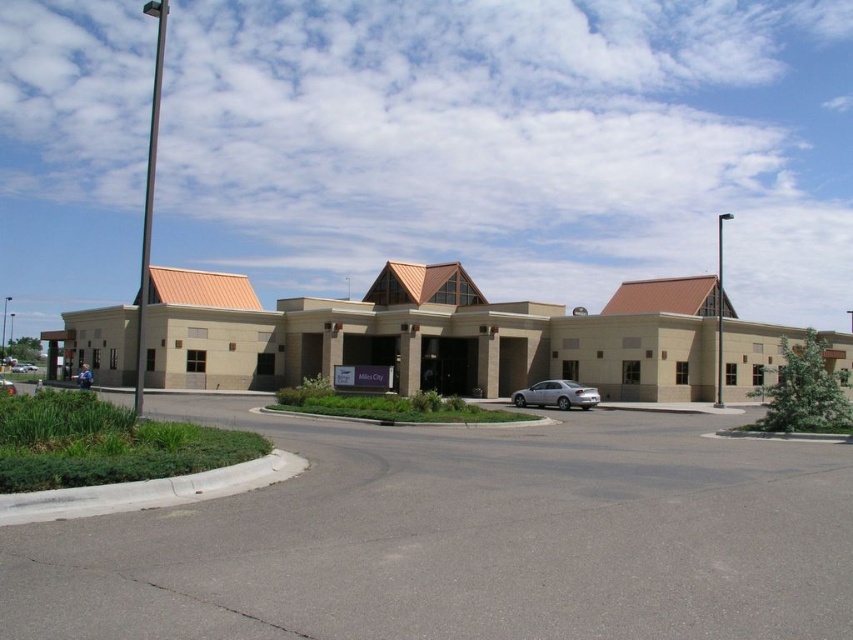
Is point (96, 618) positioned in front of point (100, 333)?

Yes, it is in front of point (100, 333).

Does gray asphalt parking lot at center have a lesser width compared to beige concrete building at center?

Correct, gray asphalt parking lot at center's width is less than beige concrete building at center's.

Does point (570, 596) lie behind point (430, 276)?

No, (570, 596) is closer to viewer.

Identify the location of gray asphalt parking lot at center. (463, 540).

Who is higher up, beige concrete building at center or silver metallic sedan at center?

Positioned higher is beige concrete building at center.

Can you confirm if beige concrete building at center is shorter than silver metallic sedan at center?

Incorrect, beige concrete building at center's height does not fall short of silver metallic sedan at center's.

Find the location of a particular element. Image resolution: width=853 pixels, height=640 pixels. beige concrete building at center is located at coordinates (432, 336).

Identify the location of beige concrete building at center. This screenshot has width=853, height=640. (432, 336).

Is gray asphalt parking lot at center positioned behind silver metallic sedan at center?

No, gray asphalt parking lot at center is in front of silver metallic sedan at center.

Does point (485, 628) lie behind point (519, 392)?

No, (485, 628) is closer to viewer.

Where is `gray asphalt parking lot at center`? This screenshot has height=640, width=853. gray asphalt parking lot at center is located at coordinates (463, 540).